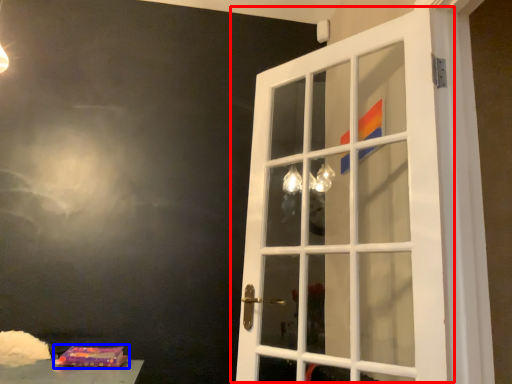
Question: Among these objects, which one is farthest to the camera, door (highlighted by a red box) or package (highlighted by a blue box)?

Choices:
 (A) door
 (B) package

Answer: (B)